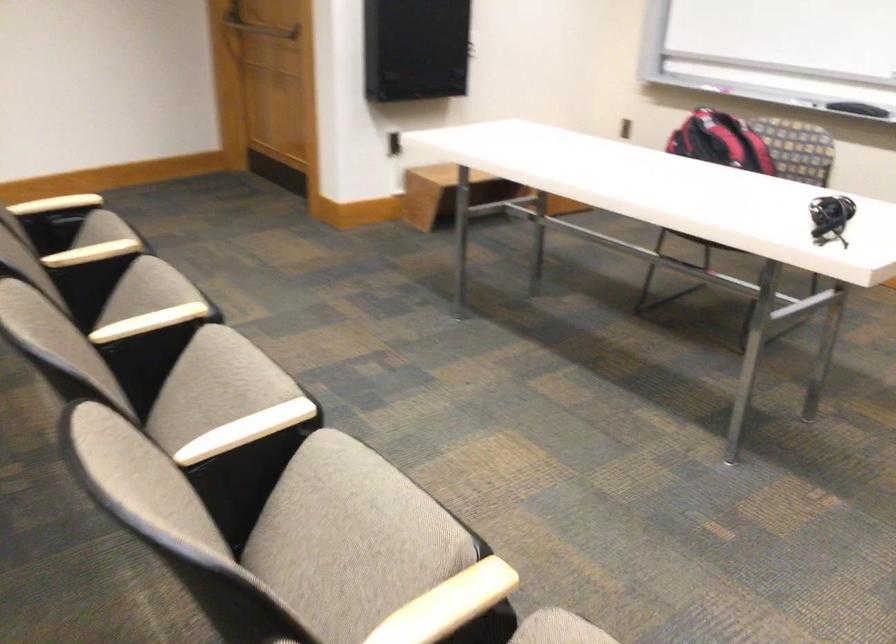
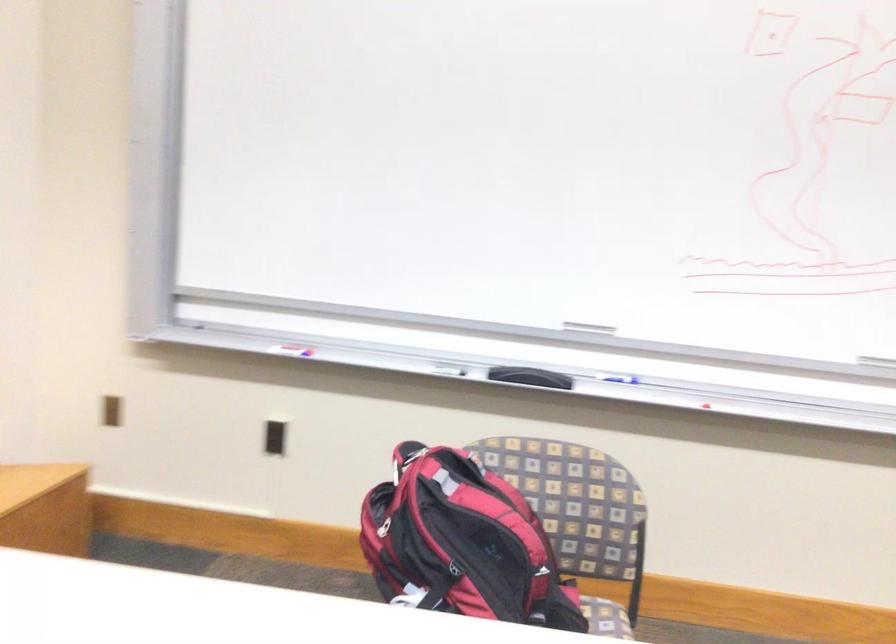
Where in the second image is the point corresponding to point (730, 69) from the first image?

(288, 345)